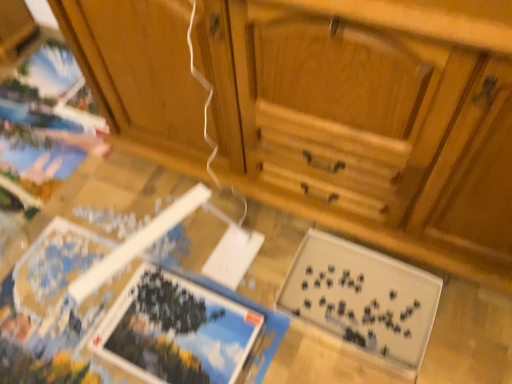
The image size is (512, 384). Find the location of `free location to the left of blue glossy puzzle piece at lower left, the 1th magazine in the left-to-right sequence`. free location to the left of blue glossy puzzle piece at lower left, the 1th magazine in the left-to-right sequence is located at coordinates (60, 319).